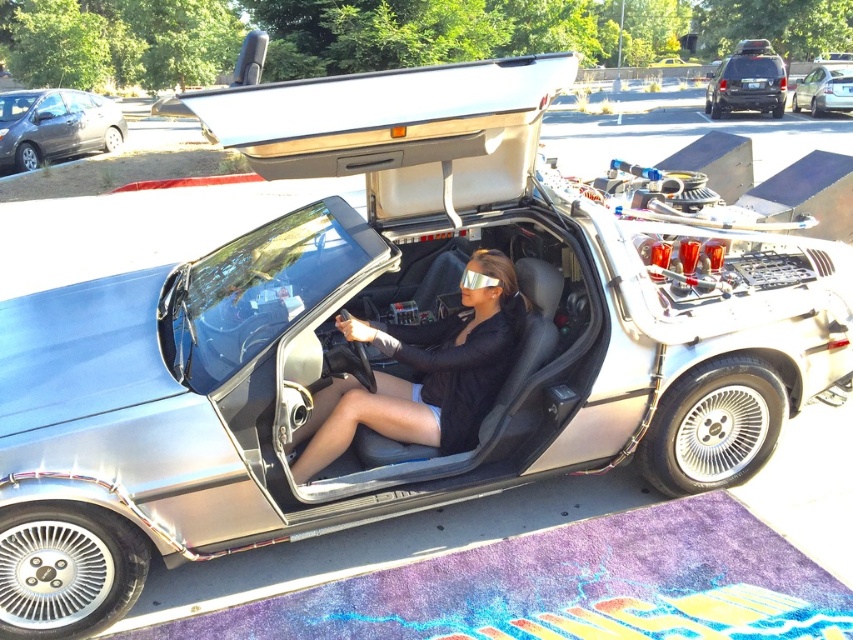
Question: Which point is farther to the camera?

Choices:
 (A) metallic gray car at upper left
 (B) matte black jacket at center

Answer: (A)

Question: Is matte black jacket at center above silver metallic sedan at upper right?

Choices:
 (A) yes
 (B) no

Answer: (B)

Question: Which of the following is the farthest from the observer?

Choices:
 (A) matte black jacket at center
 (B) black matte suv at upper right
 (C) metallic gray car at upper left

Answer: (B)

Question: Which of the following is the farthest from the observer?

Choices:
 (A) (509, 310)
 (B) (476, 276)
 (C) (16, 104)
 (D) (846, 83)

Answer: (D)

Question: Does matte black jacket at center appear over silver reflective goggles at center?

Choices:
 (A) no
 (B) yes

Answer: (A)

Question: Is metallic gray car at upper left positioned at the back of silver metallic sedan at upper right?

Choices:
 (A) yes
 (B) no

Answer: (B)